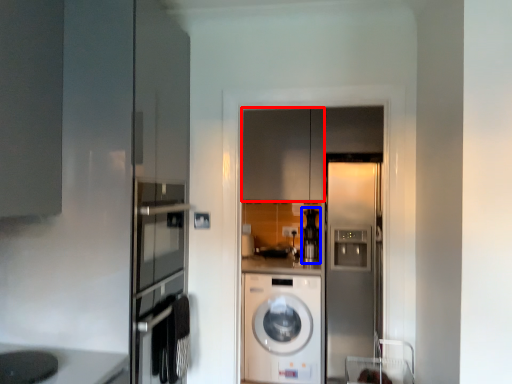
Question: Which point is closer to the camera, cabinetry (highlighted by a red box) or coffee machine (highlighted by a blue box)?

Choices:
 (A) cabinetry
 (B) coffee machine

Answer: (A)